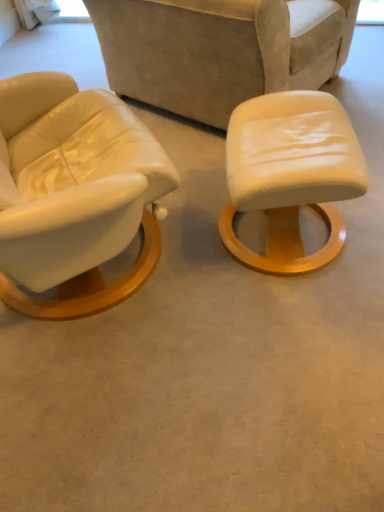
Question: From the image's perspective, is matte white stool at center positioned above or below leather-like beige chair at center?

Choices:
 (A) below
 (B) above

Answer: (A)

Question: In terms of height, does matte white stool at center look taller or shorter compared to leather-like beige chair at center?

Choices:
 (A) tall
 (B) short

Answer: (B)

Question: From a real-world perspective, is matte white stool at center physically located above or below leather-like beige chair at center?

Choices:
 (A) below
 (B) above

Answer: (A)

Question: Considering the positions of leather-like beige chair at center and matte white stool at center in the image, is leather-like beige chair at center bigger or smaller than matte white stool at center?

Choices:
 (A) big
 (B) small

Answer: (A)

Question: Relative to matte white stool at center, is leather-like beige chair at center in front or behind?

Choices:
 (A) behind
 (B) front

Answer: (A)

Question: From a real-world perspective, is leather-like beige chair at center physically located above or below matte white stool at center?

Choices:
 (A) above
 (B) below

Answer: (A)

Question: Is leather-like beige chair at center to the left or to the right of matte white stool at center in the image?

Choices:
 (A) right
 (B) left

Answer: (B)